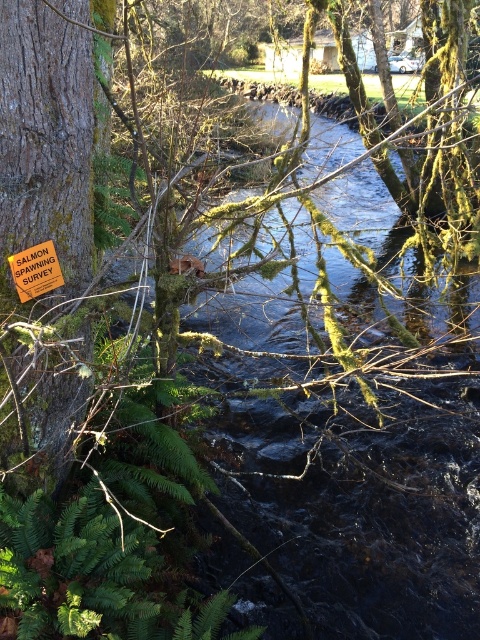
Question: Can you confirm if smooth brown bark at left is wider than orange plastic sign at left?

Choices:
 (A) yes
 (B) no

Answer: (A)

Question: Which object appears farthest from the camera in this image?

Choices:
 (A) orange plastic sign at left
 (B) smooth brown bark at left

Answer: (A)

Question: Is the position of smooth brown bark at left more distant than that of orange plastic sign at left?

Choices:
 (A) no
 (B) yes

Answer: (A)

Question: Does smooth brown bark at left appear under orange plastic sign at left?

Choices:
 (A) no
 (B) yes

Answer: (A)

Question: Which object appears closest to the camera in this image?

Choices:
 (A) orange plastic sign at left
 (B) smooth brown bark at left

Answer: (B)